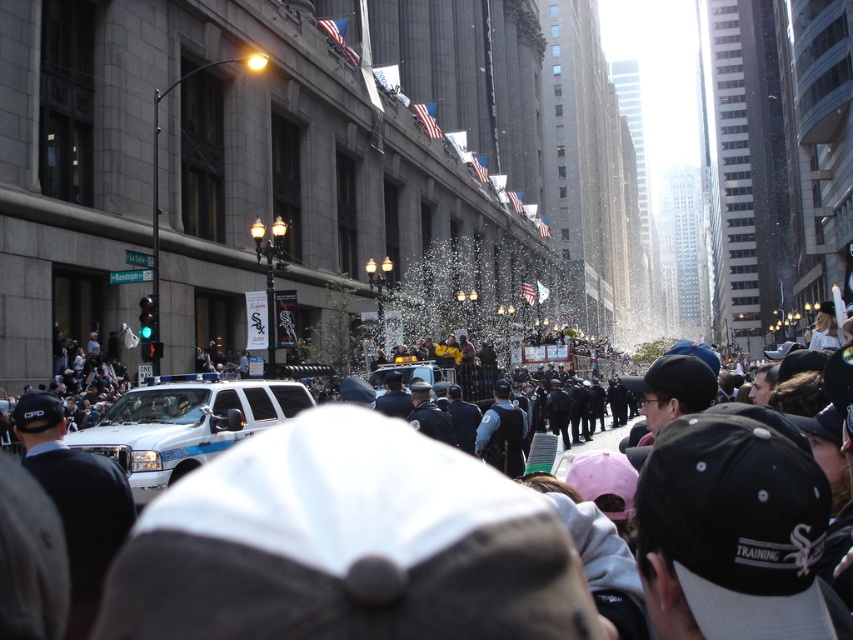
Question: Is white glossy suv at center above white glossy police car at center?

Choices:
 (A) no
 (B) yes

Answer: (A)

Question: Which object is the farthest from the white glossy suv at center?

Choices:
 (A) shiny metallic confetti at center
 (B) white glossy police car at center

Answer: (A)

Question: Which object is the farthest from the shiny metallic confetti at center?

Choices:
 (A) white glossy suv at center
 (B) white glossy police car at center

Answer: (B)

Question: Is the position of white glossy suv at center less distant than that of shiny metallic confetti at center?

Choices:
 (A) no
 (B) yes

Answer: (B)

Question: Does shiny metallic confetti at center have a larger size compared to white glossy police car at center?

Choices:
 (A) yes
 (B) no

Answer: (A)

Question: Which point appears farthest from the camera in this image?

Choices:
 (A) (426, 284)
 (B) (247, 413)

Answer: (A)